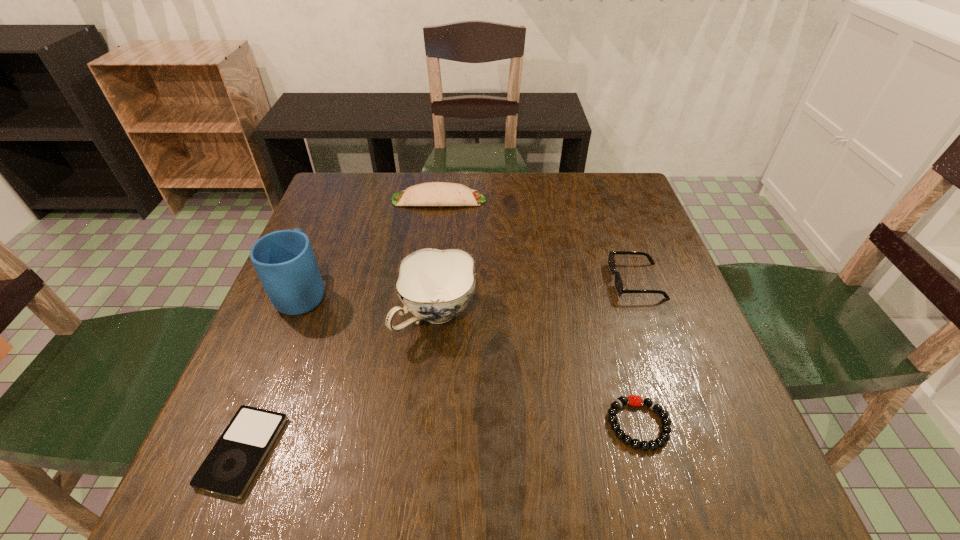
This screenshot has height=540, width=960. In order to click on free space between the fifth tallest object and the mug in this screenshot , I will do `click(471, 358)`.

The image size is (960, 540). I want to click on vacant space that's between the shortest object and the bracelet, so click(441, 438).

Where is `unoccupied area between the tallest object and the chinaware`? Image resolution: width=960 pixels, height=540 pixels. unoccupied area between the tallest object and the chinaware is located at coordinates (371, 303).

This screenshot has width=960, height=540. Find the location of `free space between the farthest object and the mug`. free space between the farthest object and the mug is located at coordinates (372, 246).

Where is `free space between the farthest object and the mug`? The width and height of the screenshot is (960, 540). free space between the farthest object and the mug is located at coordinates (372, 246).

Locate an element on the screen. The height and width of the screenshot is (540, 960). vacant area that lies between the farthest object and the bracelet is located at coordinates (539, 312).

You are a GUI agent. You are given a task and a screenshot of the screen. Output one action in this format:
    pyautogui.click(x=<x>, y=<y>)
    Task: Click on the blank region between the mug and the fifth shortest object
    The image size is (960, 540).
    Given the screenshot: What is the action you would take?
    pyautogui.click(x=371, y=303)

Find the location of a particular element. This screenshot has width=960, height=540. free spot between the fifth tallest object and the shortest object is located at coordinates (441, 438).

I want to click on object that is the fourth closest to the fifth shortest object, so click(431, 193).

Select which object is the fifth closest to the fifth shortest object. Please provide its 2D coordinates. Your answer should be formatted as a tuple, i.e. [(x, y)], where the tuple contains the x and y coordinates of a point satisfying the conditions above.

[(611, 260)]